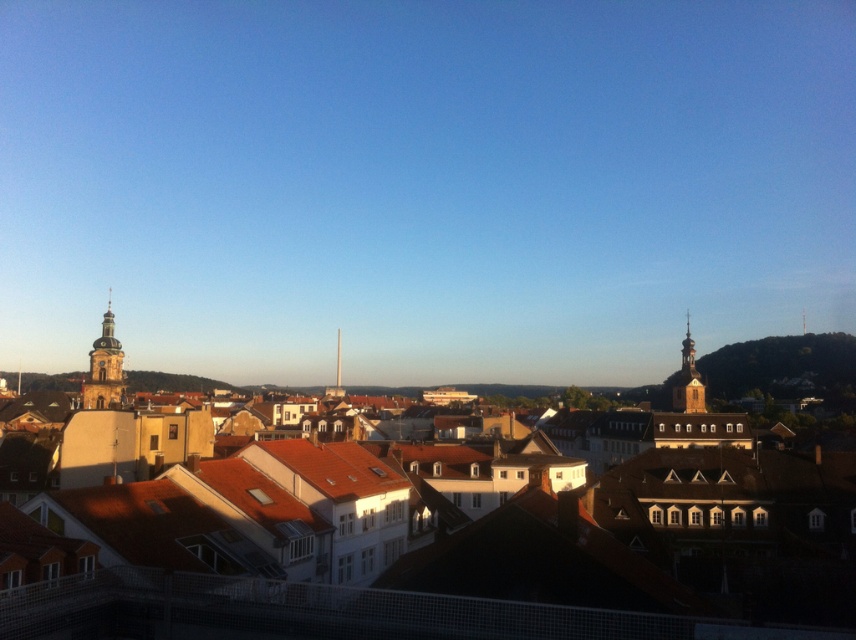
Is golden stone tower at left behind gold ornate tower at right?

No, golden stone tower at left is in front of gold ornate tower at right.

Can you confirm if golden stone tower at left is positioned below gold ornate tower at right?

Incorrect, golden stone tower at left is not positioned below gold ornate tower at right.

Between point (108, 310) and point (700, 404), which one is positioned in front?

Point (108, 310)

This screenshot has height=640, width=856. Identify the location of golden stone tower at left. (104, 369).

Who is lower down, brown clay roof tiles at center or gold ornate tower at right?

brown clay roof tiles at center is lower down.

Does brown clay roof tiles at center lie in front of gold ornate tower at right?

That is True.

Between point (710, 486) and point (691, 355), which one is positioned in front?

Point (710, 486)

At what (x,y) coordinates should I click in order to perform the action: click on brown clay roof tiles at center. Please return your answer as a coordinate pair (x, y). Looking at the image, I should click on (280, 538).

Who is positioned more to the right, brown clay roof tiles at center or golden stone tower at left?

brown clay roof tiles at center

Which is in front, point (565, 541) or point (107, 333)?

Point (565, 541) is more forward.

Does point (435, 541) lie in front of point (102, 378)?

Yes.

This screenshot has width=856, height=640. In order to click on brown clay roof tiles at center in this screenshot , I will do `click(280, 538)`.